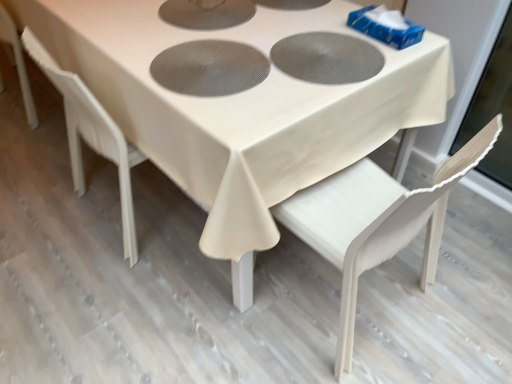
Question: In terms of width, does white fabric table at center look wider or thinner when compared to white plastic chair at lower left, acting as the first chair starting from the left?

Choices:
 (A) thin
 (B) wide

Answer: (B)

Question: In terms of size, does white fabric table at center appear bigger or smaller than white plastic chair at lower left, arranged as the 2th chair when viewed from the right?

Choices:
 (A) small
 (B) big

Answer: (B)

Question: Which of these objects is positioned farthest from the white matte chair at lower right, the 1th chair from the right?

Choices:
 (A) white plastic chair at lower left, acting as the first chair starting from the left
 (B) white fabric table at center

Answer: (A)

Question: Estimate the real-world distances between objects in this image. Which object is closer to the white matte chair at lower right, the 1th chair from the right?

Choices:
 (A) white plastic chair at lower left, acting as the first chair starting from the left
 (B) white fabric table at center

Answer: (B)